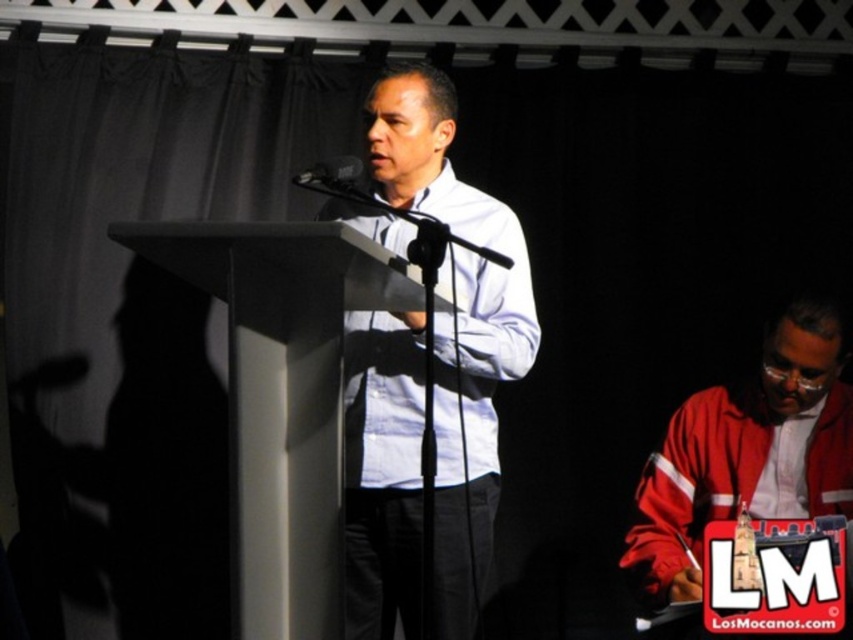
You are attending a formal event and notice a red matte jacket at lower right. If you want to retrieve it without moving from your current position, can you reach it?

The red matte jacket at lower right is 7.06 feet away from the viewer. Since the average human arm length is about 2.5 feet, you cannot reach it without moving.

You are attending a formal event and want to approach the speaker. The speaker is standing near the white smooth podium at center. Based on the coordinates provided, in which general direction should you move from the center of the image to reach the podium?

The white smooth podium at center is located at coordinates point (282, 397). Since the x coordinate is greater than 0.5, it is to the right of center. The y coordinate is 0.332, which is below the center point of the image. Therefore, you should move to the right and slightly downward from the center to reach the white smooth podium at center.

You are organizing a small event and need to place a 1.2 meter wide banner between the white smooth podium at center and the red matte jacket at lower right. Based on the image, can the banner fit between them?

The white smooth podium at center might be wider than red matte jacket at lower right, so the banner may not fit between them since the podium could take up more space than the jacket.